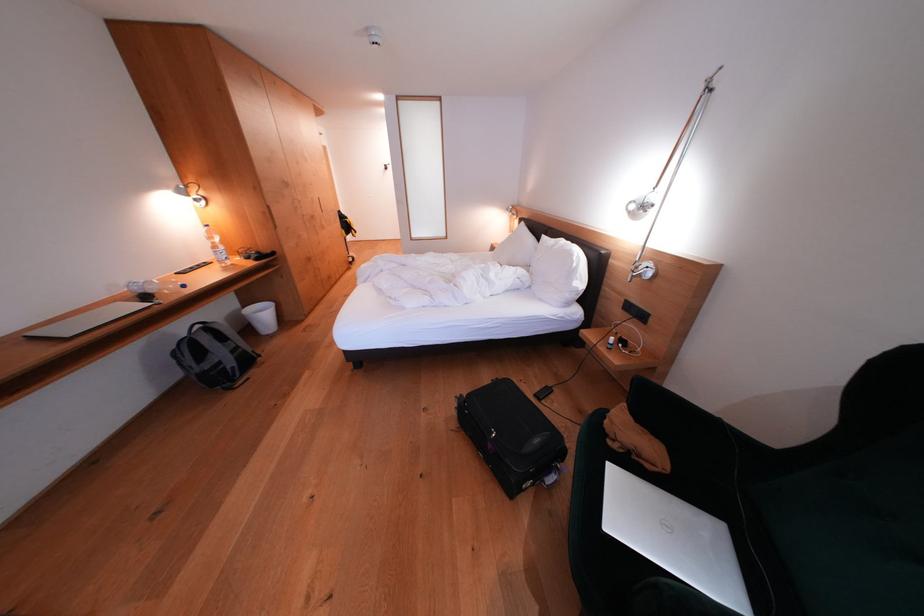
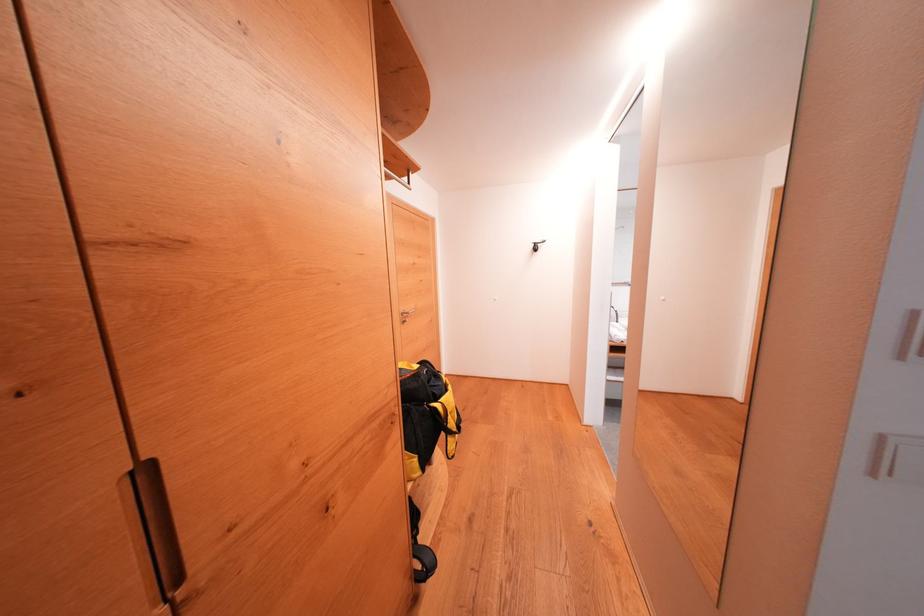
What movement of the cameraman would produce the second image?

The movement direction of the cameraman is left, forward.